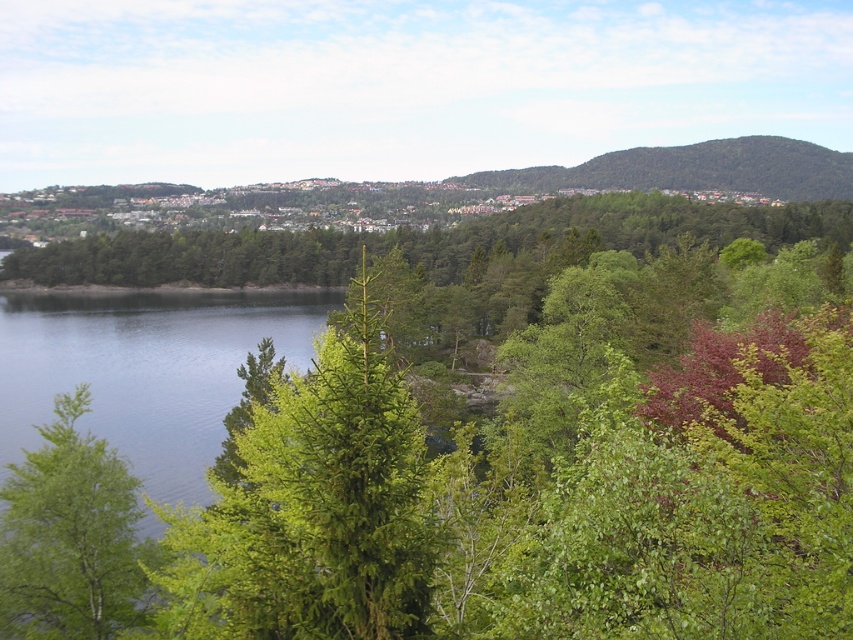
Who is taller, blue water at left or green leafy hillside at upper center?

green leafy hillside at upper center is taller.

From the picture: Which is more to the left, blue water at left or green leafy hillside at upper center?

From the viewer's perspective, blue water at left appears more on the left side.

Is point (184, 477) positioned behind point (654, 160)?

No.

You are a GUI agent. You are given a task and a screenshot of the screen. Output one action in this format:
    pyautogui.click(x=<x>, y=<y>)
    Task: Click on the blue water at left
    
    Given the screenshot: What is the action you would take?
    pyautogui.click(x=144, y=368)

Can you confirm if blue water at left is positioned to the right of green leafy tree at lower left?

Incorrect, blue water at left is not on the right side of green leafy tree at lower left.

Locate an element on the screen. This screenshot has width=853, height=640. blue water at left is located at coordinates (144, 368).

Does green leafy tree at center have a lesser height compared to green leafy hillside at upper center?

Indeed, green leafy tree at center has a lesser height compared to green leafy hillside at upper center.

Does green leafy tree at center have a lesser width compared to green leafy hillside at upper center?

Yes.

Which is behind, point (567, 422) or point (683, 180)?

The point (683, 180) is more distant.

Locate an element on the screen. The height and width of the screenshot is (640, 853). green leafy tree at center is located at coordinates (488, 472).